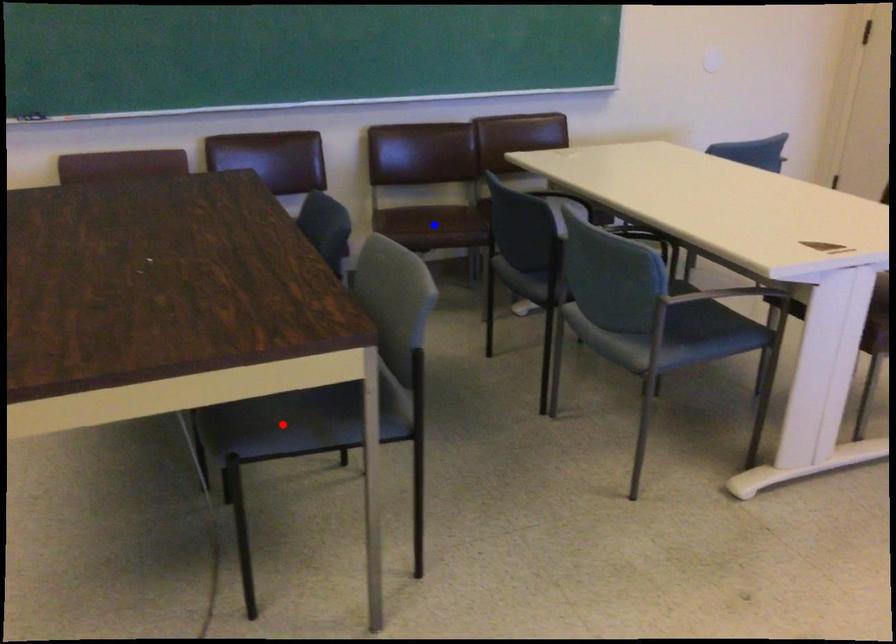
Question: In the image, two points are highlighted. Which point is nearer to the camera? Reply with the corresponding letter.

Choices:
 (A) blue point
 (B) red point

Answer: (B)